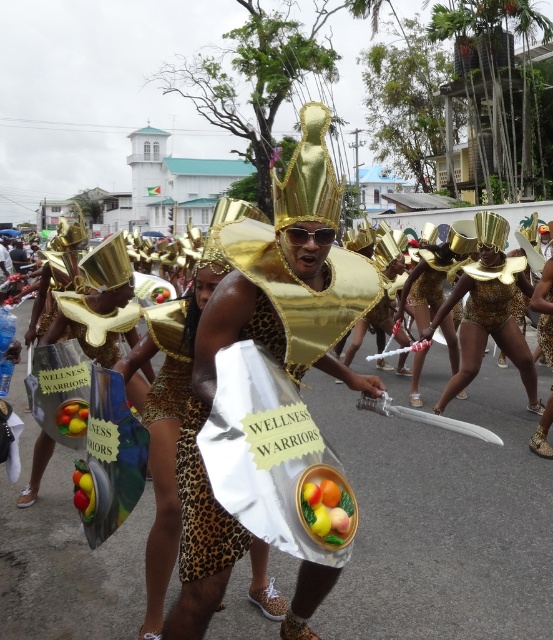
In the scene shown: In the parade scene, you see the gold leopard print costume at center and the smooth plastic fruit basket at center. Which object is covering the other?

The gold leopard print costume at center is positioned over the smooth plastic fruit basket at center, so it is covering it.

You are a photographer at the Wellness Warriors parade. You want to take a photo of both the gold leopard print dress at center and the shiny plastic apple at center. However, the apple is partially hidden. Where should you move to ensure both are fully visible in your shot?

The shiny plastic apple at center is behind the gold leopard print dress at center. To capture both fully, move to a position where you can see around or past the gold leopard print dress at center to reveal the shiny plastic apple at center.